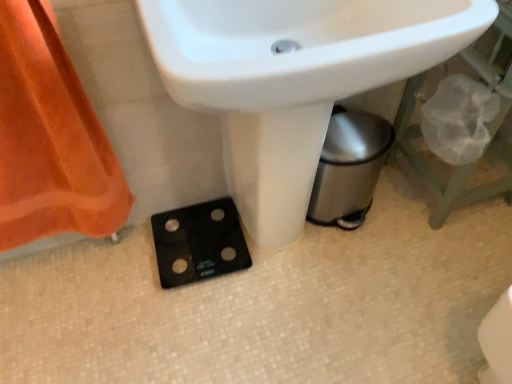
Find the location of a particular element. Image resolution: width=512 pixels, height=384 pixels. free space in front of black glass scale at lower center is located at coordinates (194, 316).